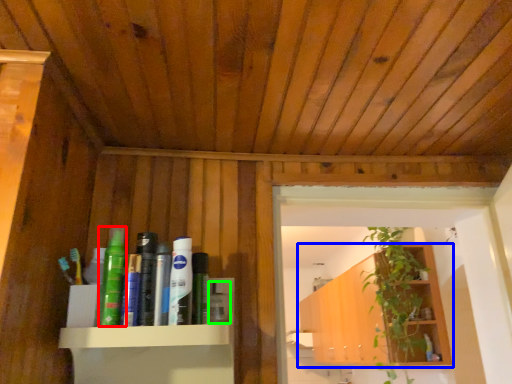
Question: Estimate the real-world distances between objects in this image. Which object is farther from toiletry (highlighted by a red box), shelf (highlighted by a blue box) or toiletry (highlighted by a green box)?

Choices:
 (A) shelf
 (B) toiletry

Answer: (A)